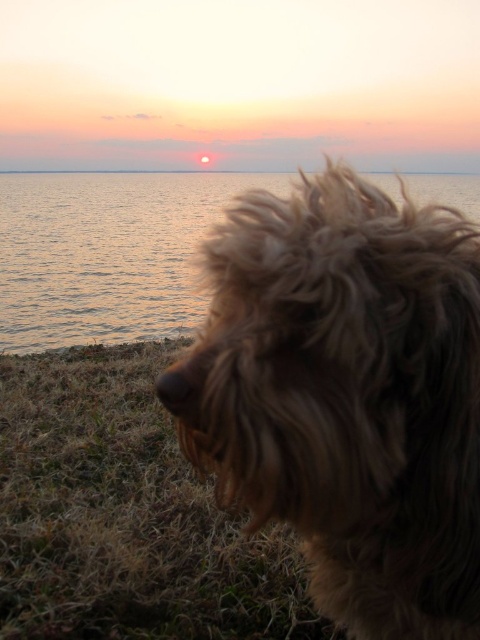
Question: Which object is positioned closest to the shiny blue water at center?

Choices:
 (A) smooth ocean at center
 (B) brown grassy at lower left

Answer: (A)

Question: Which object appears closest to the camera in this image?

Choices:
 (A) brown grassy at lower left
 (B) shiny blue water at center
 (C) smooth ocean at center
 (D) fuzzy brown dog at center

Answer: (D)

Question: From the image, what is the correct spatial relationship of fuzzy brown dog at center in relation to brown grassy at lower left?

Choices:
 (A) left
 (B) right

Answer: (B)

Question: Among these objects, which one is nearest to the camera?

Choices:
 (A) smooth ocean at center
 (B) brown grassy at lower left
 (C) shiny blue water at center

Answer: (C)

Question: Does fuzzy brown dog at center have a greater width compared to shiny blue water at center?

Choices:
 (A) no
 (B) yes

Answer: (A)

Question: Does fuzzy brown dog at center have a greater width compared to brown grassy at lower left?

Choices:
 (A) no
 (B) yes

Answer: (A)